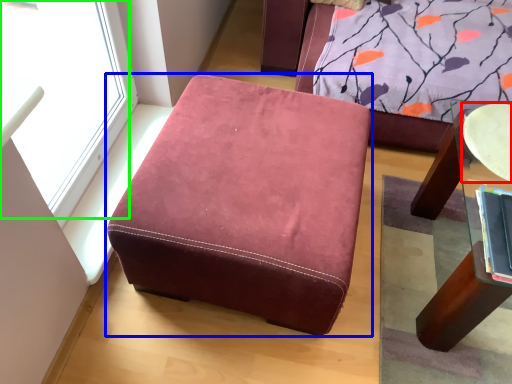
Question: Which object is positioned closest to round table (highlighted by a red box)? Select from furniture (highlighted by a blue box) and window (highlighted by a green box).

Choices:
 (A) furniture
 (B) window

Answer: (A)